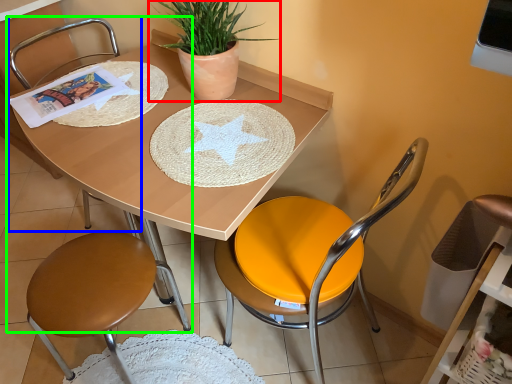
Question: Which object is the farthest from houseplant (highlighted by a red box)? Choose among these: armchair (highlighted by a blue box) or chair (highlighted by a green box).

Choices:
 (A) armchair
 (B) chair

Answer: (A)